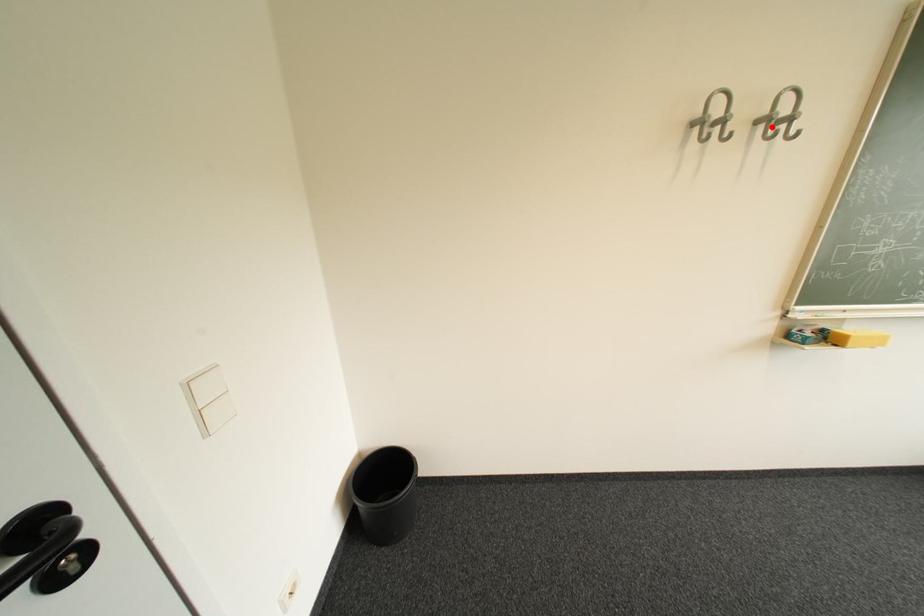
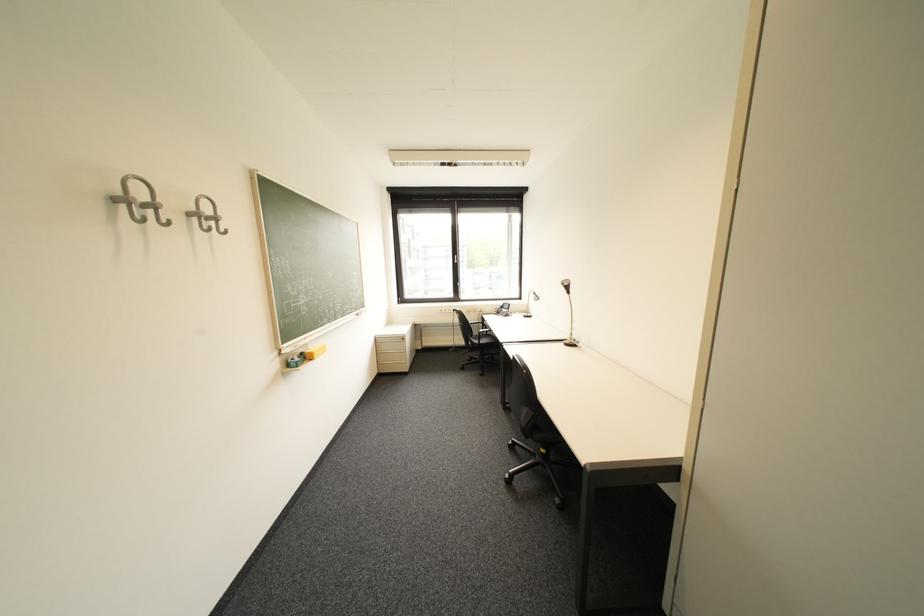
In the second image, find the point that corresponds to the highlighted location in the first image.

(205, 220)